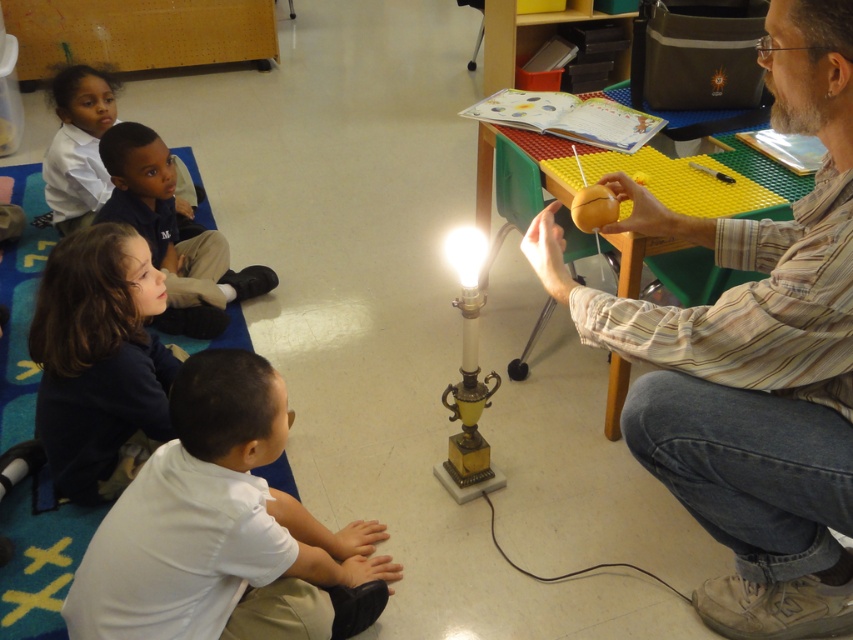
Is brown uniform at lower left smaller than matte white shirt at upper left?

Actually, brown uniform at lower left might be larger than matte white shirt at upper left.

Is the position of brown uniform at lower left less distant than that of matte white shirt at upper left?

That is True.

Locate an element on the screen. Image resolution: width=853 pixels, height=640 pixels. brown uniform at lower left is located at coordinates click(x=172, y=234).

Find the location of a particular element. This screenshot has width=853, height=640. brown uniform at lower left is located at coordinates (172, 234).

Is the position of white matte shirt at lower left more distant than that of brown uniform at lower left?

No, white matte shirt at lower left is in front of brown uniform at lower left.

Is white matte shirt at lower left shorter than brown uniform at lower left?

Yes.

The height and width of the screenshot is (640, 853). In order to click on white matte shirt at lower left in this screenshot , I will do `click(223, 529)`.

Image resolution: width=853 pixels, height=640 pixels. I want to click on white matte shirt at lower left, so click(x=223, y=529).

Between matte brown ball at right and matte white shirt at upper left, which one is positioned higher?

matte white shirt at upper left is above.

Between matte brown ball at right and matte white shirt at upper left, which one has more height?

matte brown ball at right

Locate an element on the screen. The image size is (853, 640). matte brown ball at right is located at coordinates pos(752,356).

Locate an element on the screen. Image resolution: width=853 pixels, height=640 pixels. matte brown ball at right is located at coordinates (752, 356).